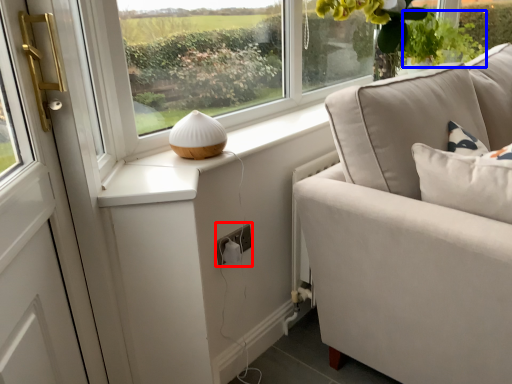
Question: Which of the following is the closest to the observer, electric outlet (highlighted by a red box) or plant (highlighted by a blue box)?

Choices:
 (A) electric outlet
 (B) plant

Answer: (A)